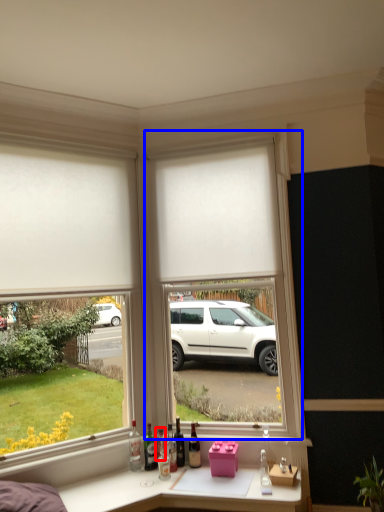
Question: Which of the following is the closest to the observer, bottle (highlighted by a red box) or window frame (highlighted by a blue box)?

Choices:
 (A) bottle
 (B) window frame

Answer: (B)